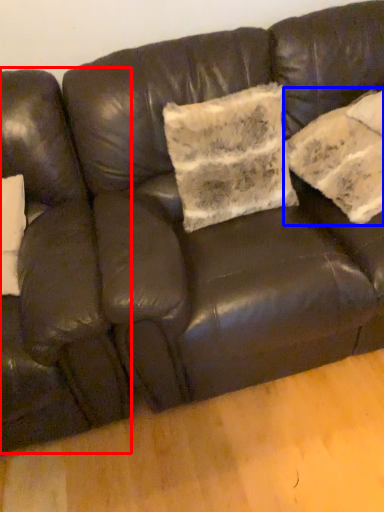
Question: Which object is closer to the camera taking this photo, armchair (highlighted by a red box) or pillow (highlighted by a blue box)?

Choices:
 (A) armchair
 (B) pillow

Answer: (A)